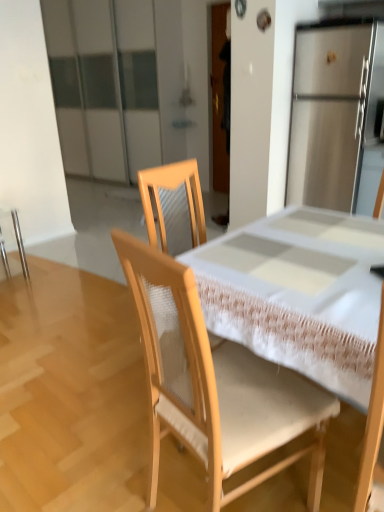
Identify the location of free space that is to the left of wooden chair at center, positioned as the 2th chair in left-to-right order. (x=101, y=461).